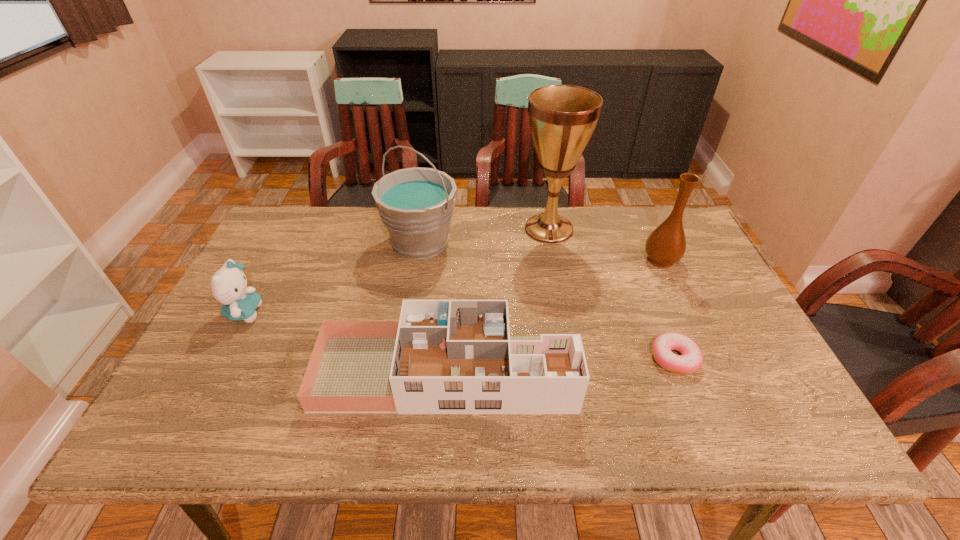
Where is `the tallest object`? the tallest object is located at coordinates (562, 118).

Where is `bucket`? The height and width of the screenshot is (540, 960). bucket is located at coordinates (416, 204).

At what (x,y) coordinates should I click in order to perform the action: click on vase. Please return your answer as a coordinate pair (x, y). The height and width of the screenshot is (540, 960). Looking at the image, I should click on (666, 245).

Locate an element on the screen. Image resolution: width=960 pixels, height=540 pixels. kitten is located at coordinates (229, 284).

The width and height of the screenshot is (960, 540). In order to click on the fourth farthest object in this screenshot , I will do pyautogui.click(x=229, y=284).

At what (x,y) coordinates should I click in order to perform the action: click on the second shortest object. Please return your answer as a coordinate pair (x, y). This screenshot has width=960, height=540. Looking at the image, I should click on (443, 356).

Locate an element on the screen. The width and height of the screenshot is (960, 540). doughnut is located at coordinates point(690,360).

Locate an element on the screen. The width and height of the screenshot is (960, 540). free space located on the front of the trophy cup is located at coordinates (566, 321).

Locate an element on the screen. vacant space located on the left of the bucket is located at coordinates (280, 242).

Locate an element on the screen. The height and width of the screenshot is (540, 960). free space located 0.110m on the front of the vase is located at coordinates coord(679,300).